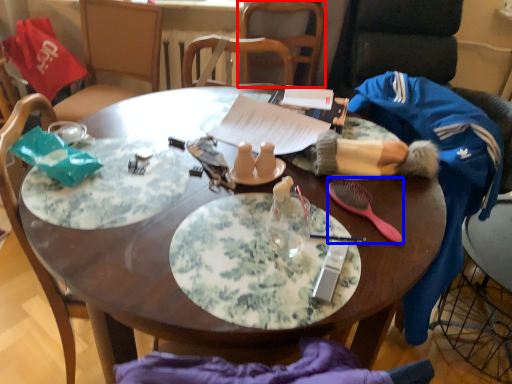
Question: Which object is further to the camera taking this photo, chair (highlighted by a red box) or tableware (highlighted by a blue box)?

Choices:
 (A) chair
 (B) tableware

Answer: (A)